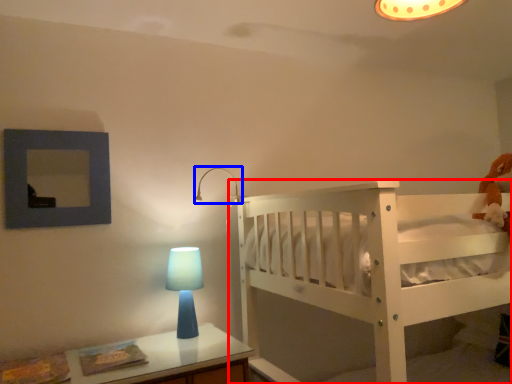
Question: Which object appears closest to the camera in this image, infant bed (highlighted by a red box) or lamp (highlighted by a blue box)?

Choices:
 (A) infant bed
 (B) lamp

Answer: (A)